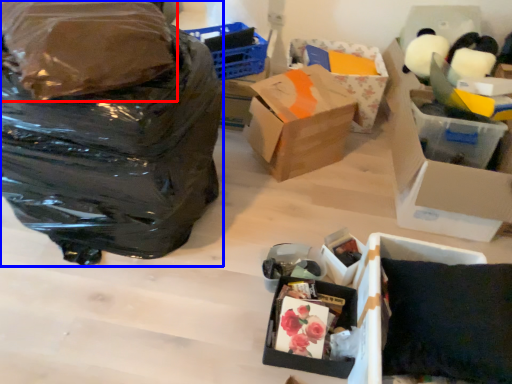
Question: Which object appears farthest to the camera in this image, plastic bag (highlighted by a red box) or bag (highlighted by a blue box)?

Choices:
 (A) plastic bag
 (B) bag

Answer: (B)